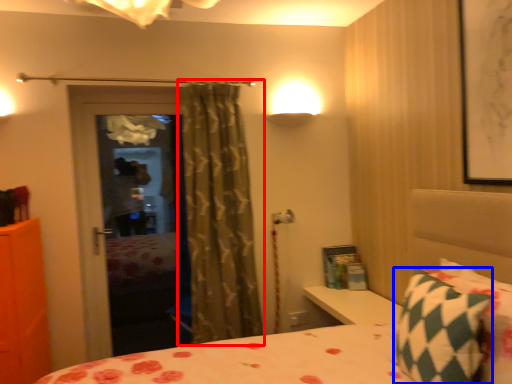
Question: Which of the following is the farthest to the observer, curtain (highlighted by a red box) or pillow (highlighted by a blue box)?

Choices:
 (A) curtain
 (B) pillow

Answer: (A)